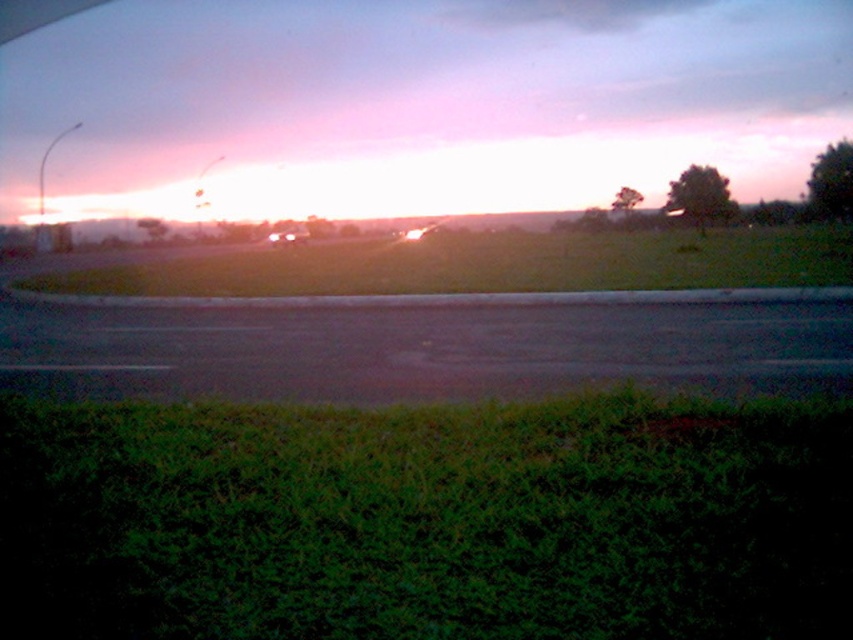
Does black asphalt highway at center have a lesser width compared to matte black car at center?

In fact, black asphalt highway at center might be wider than matte black car at center.

Can you confirm if black asphalt highway at center is smaller than matte black car at center?

Indeed, black asphalt highway at center has a smaller size compared to matte black car at center.

You are a GUI agent. You are given a task and a screenshot of the screen. Output one action in this format:
    pyautogui.click(x=<x>, y=<y>)
    Task: Click on the black asphalt highway at center
    The height and width of the screenshot is (640, 853).
    Given the screenshot: What is the action you would take?
    pyautogui.click(x=421, y=349)